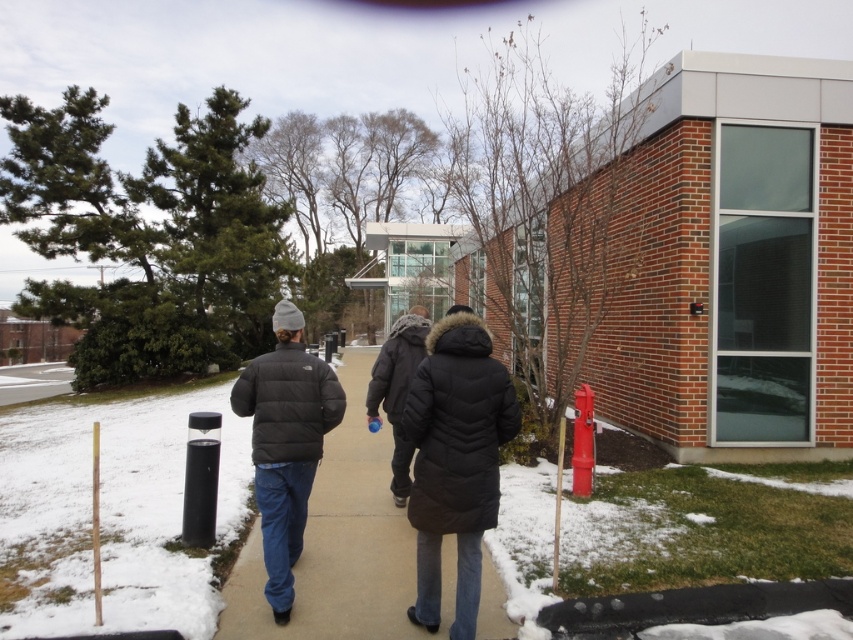
You are standing at the point marked as point (338,544) in the image. What object is located exactly at that point?

The black puffer jacket at center is located exactly at point (338,544).

You are standing at the point closer to the camera in the image. Which point are you at, point (396, 605) or point (282, 500)?

You are at point (396, 605) because it is closer to the camera than point (282, 500).